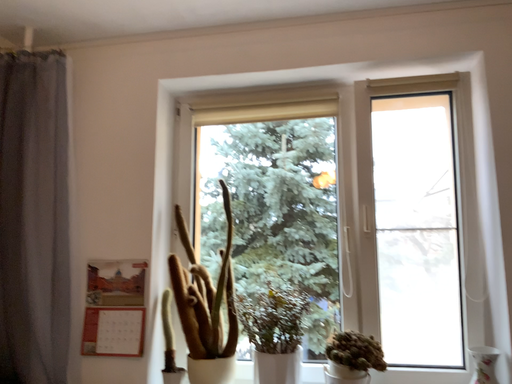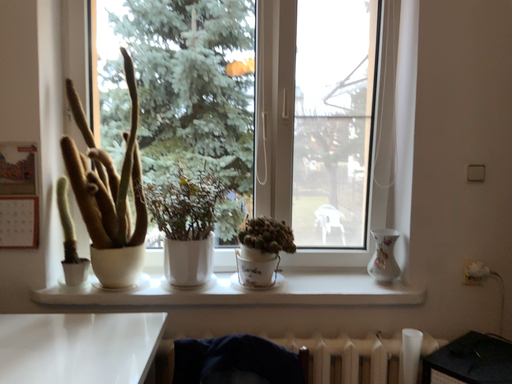
Question: How did the camera likely rotate when shooting the video?

Choices:
 (A) rotated right
 (B) rotated left

Answer: (A)